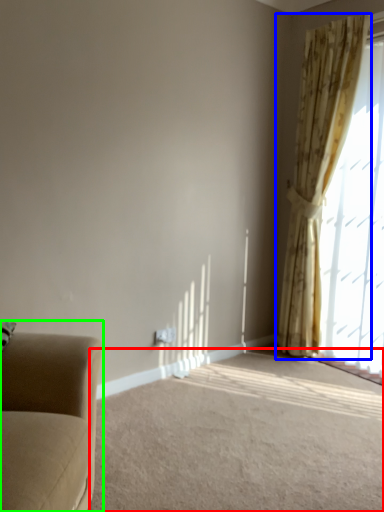
Question: Which object is the farthest from plain (highlighted by a red box)? Choose among these: curtain (highlighted by a blue box) or studio couch (highlighted by a green box).

Choices:
 (A) curtain
 (B) studio couch

Answer: (A)